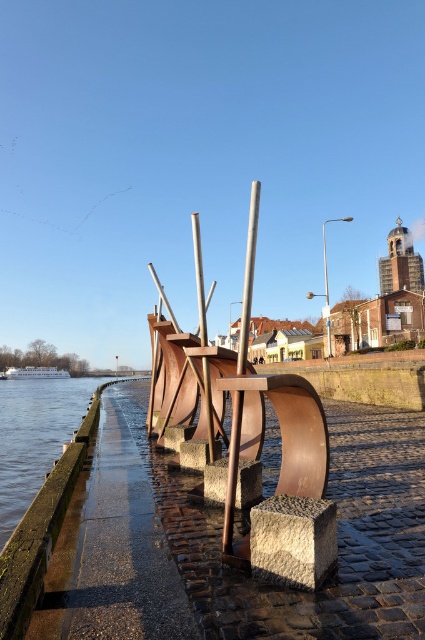
You are standing on the cobblestone path and want to take a photo of both the rusty metal sculpture at center and the smooth wood pole at center. Which object should you focus on first to ensure both are in the frame?

You should focus on the rusty metal sculpture at center first because it is closer to you than the smooth wood pole at center, so adjusting the focus to it will help include both in the frame.

Based on the photo, you are a maintenance worker who needs to replace a pole. You have a new pole that is 6 feet long. There are two poles in the scene, the smooth wood pole at center and the polished metal pole at center. Can the new pole fit exactly between them without overlapping?

The distance between the smooth wood pole at center and the polished metal pole at center is 6.04 feet. Since the new pole is 6 feet long, it can fit between them without overlapping as there is a slight extra space.

You are standing on the cobblestone path by the water and see the rusty metal sculpture at center and the polished metal pole at center. Which one is positioned to the right side?

The rusty metal sculpture at center is positioned to the right of the polished metal pole at center.